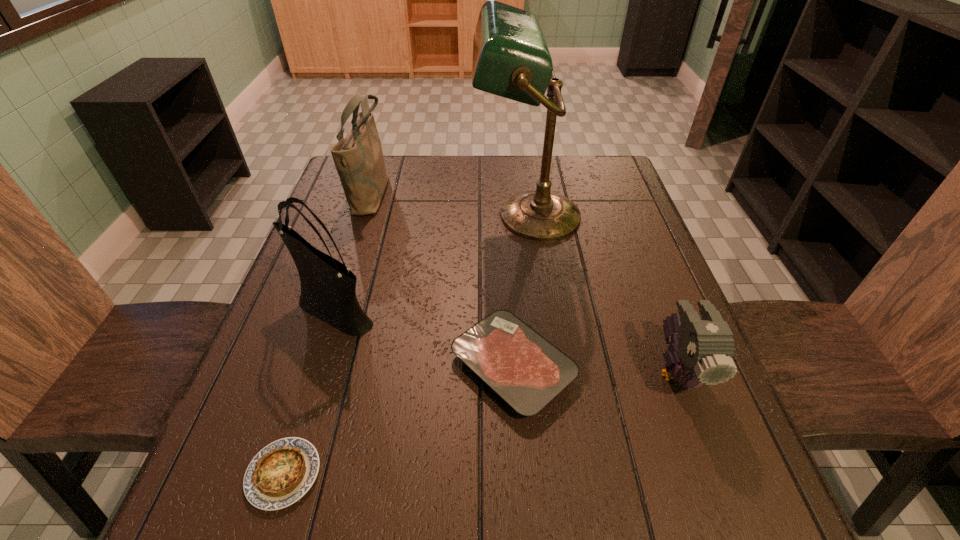
Where is `vacant region located 0.230m above the green lampshade of the tallest object`? The width and height of the screenshot is (960, 540). vacant region located 0.230m above the green lampshade of the tallest object is located at coordinates (391, 216).

Identify the location of free region located 0.230m on the front-facing side of the farther shoulder bag. This screenshot has height=540, width=960. (468, 192).

Locate an element on the screen. The image size is (960, 540). vacant area situated 0.240m on the right of the nearer shoulder bag is located at coordinates (489, 310).

Locate an element on the screen. The width and height of the screenshot is (960, 540). vacant point located at the beak of the bird is located at coordinates (732, 515).

At what (x,y) coordinates should I click in order to perform the action: click on free region located 0.270m on the back of the steak. Please return your answer as a coordinate pair (x, y). This screenshot has height=540, width=960. Looking at the image, I should click on (505, 239).

Find the location of `vacant space located 0.070m on the back of the quiche`. vacant space located 0.070m on the back of the quiche is located at coordinates (306, 403).

Image resolution: width=960 pixels, height=540 pixels. Identify the location of table lamp that is positioned at the far edge. (511, 59).

Where is `shoulder bag that is positioned at the far edge`? Image resolution: width=960 pixels, height=540 pixels. shoulder bag that is positioned at the far edge is located at coordinates (358, 157).

The width and height of the screenshot is (960, 540). Identify the location of object present at the near edge. (x=280, y=474).

The width and height of the screenshot is (960, 540). I want to click on quiche that is at the left edge, so click(280, 474).